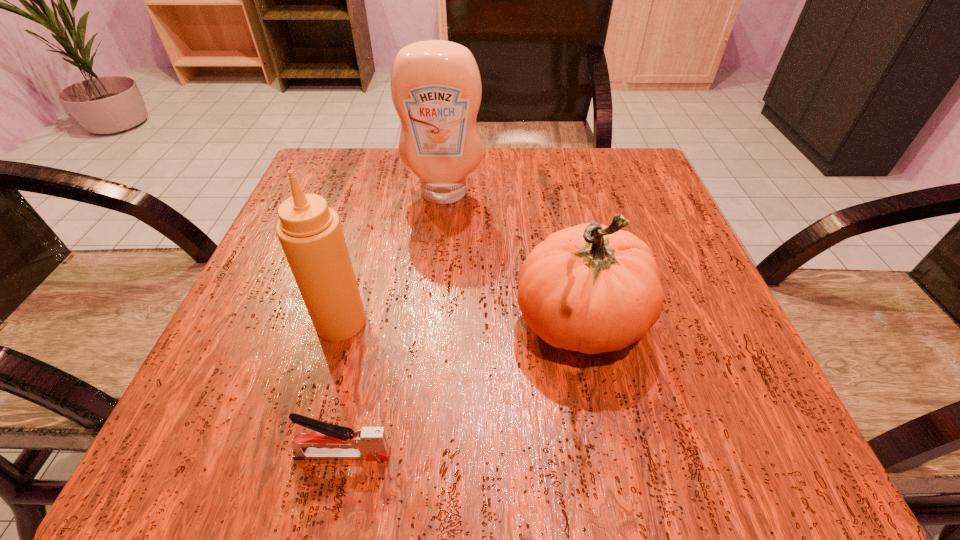
The width and height of the screenshot is (960, 540). I want to click on vacant area at the far right corner of the desktop, so click(x=635, y=173).

Image resolution: width=960 pixels, height=540 pixels. In order to click on unoccupied area between the left condiment and the rightmost object in this screenshot , I will do `click(461, 323)`.

Image resolution: width=960 pixels, height=540 pixels. Identify the location of free space between the right condiment and the nearest object. (394, 324).

You are a GUI agent. You are given a task and a screenshot of the screen. Output one action in this format:
    pyautogui.click(x=<x>, y=<y>)
    Task: Click on the free spot between the shortest object and the left condiment
    
    Given the screenshot: What is the action you would take?
    pyautogui.click(x=342, y=388)

This screenshot has width=960, height=540. Identify the location of free spot between the pumpkin and the left condiment. (461, 323).

The image size is (960, 540). I want to click on empty space between the shortest object and the nearer condiment, so click(x=342, y=388).

Find the location of a particular element. vacant space that's between the nearest object and the left condiment is located at coordinates (342, 388).

The height and width of the screenshot is (540, 960). In order to click on free space that is in between the nearer condiment and the shortest object in this screenshot , I will do `click(342, 388)`.

The width and height of the screenshot is (960, 540). I want to click on free spot between the pumpkin and the nearer condiment, so click(461, 323).

You are a GUI agent. You are given a task and a screenshot of the screen. Output one action in this format:
    pyautogui.click(x=<x>, y=<y>)
    Task: Click on the empty space that is in between the farthest object and the shortest object
    
    Given the screenshot: What is the action you would take?
    394,324